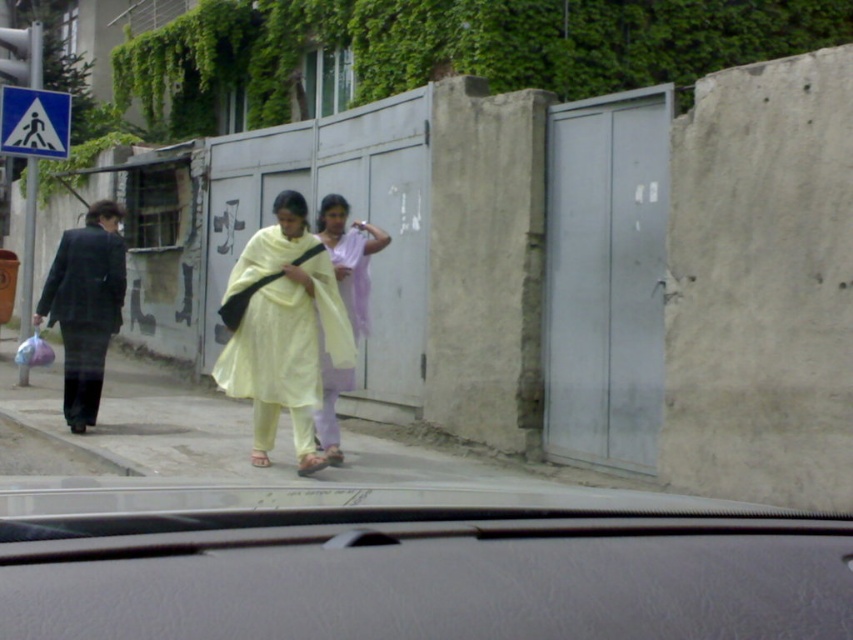
Question: Is light yellow fabric at center in front of light purple fabric at center?

Choices:
 (A) yes
 (B) no

Answer: (A)

Question: Is light yellow fabric at center positioned in front of light purple fabric at center?

Choices:
 (A) yes
 (B) no

Answer: (A)

Question: Is light yellow fabric at center thinner than light purple fabric at center?

Choices:
 (A) yes
 (B) no

Answer: (B)

Question: Which point is closer to the camera?

Choices:
 (A) (65, 348)
 (B) (354, 352)

Answer: (B)

Question: Which of the following is the farthest from the observer?

Choices:
 (A) light purple fabric at center
 (B) light yellow fabric at center

Answer: (A)

Question: Which of the following is the closest to the observer?

Choices:
 (A) light yellow fabric at center
 (B) light purple fabric at center
 (C) matte black suit at left

Answer: (A)